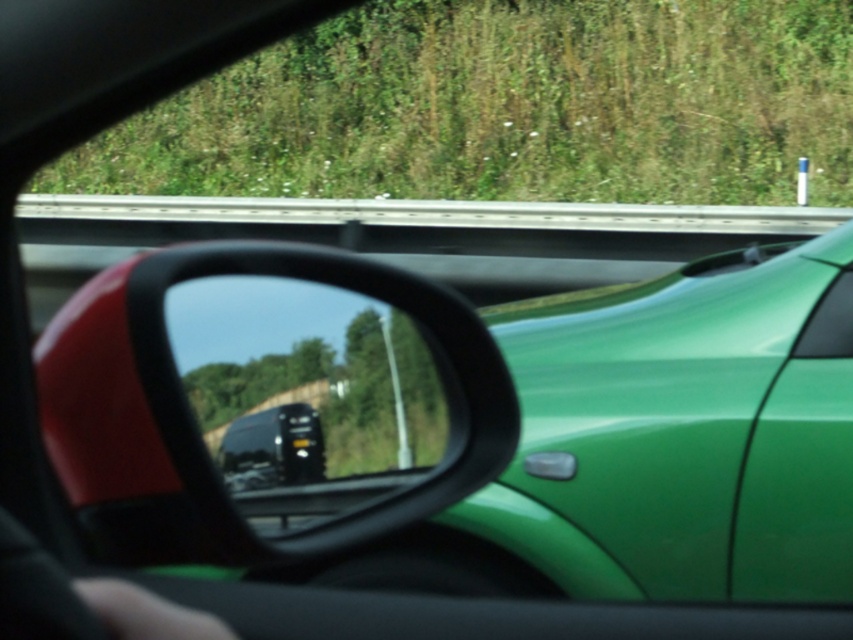
Is point (320, 552) farther from camera compared to point (839, 294)?

No.

Is black glossy mirror at center to the right of green glossy car window at upper right from the viewer's perspective?

Incorrect, black glossy mirror at center is not on the right side of green glossy car window at upper right.

Is point (428, 394) closer to camera compared to point (824, 307)?

Yes, it is.

At what (x,y) coordinates should I click in order to perform the action: click on black glossy mirror at center. Please return your answer as a coordinate pair (x, y). The height and width of the screenshot is (640, 853). Looking at the image, I should click on (314, 394).